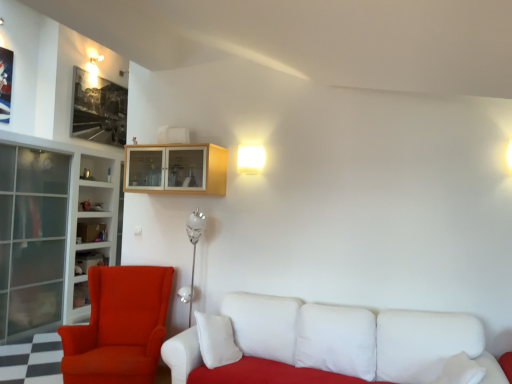
Question: Can you confirm if black matte picture frame at upper left is wider than matte glass shelf at left?

Choices:
 (A) yes
 (B) no

Answer: (B)

Question: Considering the relative sizes of black matte picture frame at upper left and matte glass shelf at left in the image provided, is black matte picture frame at upper left smaller than matte glass shelf at left?

Choices:
 (A) no
 (B) yes

Answer: (A)

Question: Is black matte picture frame at upper left facing towards matte glass shelf at left?

Choices:
 (A) no
 (B) yes

Answer: (A)

Question: Is black matte picture frame at upper left far away from matte glass shelf at left?

Choices:
 (A) no
 (B) yes

Answer: (B)

Question: Does black matte picture frame at upper left come in front of matte glass shelf at left?

Choices:
 (A) no
 (B) yes

Answer: (A)

Question: Is point (112, 213) closer or farther from the camera than point (78, 273)?

Choices:
 (A) closer
 (B) farther

Answer: (A)

Question: Considering the positions of white glass bookshelf at left and matte glass shelf at left in the image, is white glass bookshelf at left bigger or smaller than matte glass shelf at left?

Choices:
 (A) small
 (B) big

Answer: (B)

Question: From the image's perspective, is white glass bookshelf at left located above or below matte glass shelf at left?

Choices:
 (A) above
 (B) below

Answer: (A)

Question: From a real-world perspective, is white glass bookshelf at left above or below matte glass shelf at left?

Choices:
 (A) above
 (B) below

Answer: (A)

Question: Does point (424, 322) appear closer or farther from the camera than point (142, 362)?

Choices:
 (A) farther
 (B) closer

Answer: (B)

Question: From a real-world perspective, is white soft pillow at lower right physically located above or below velvet orange armchair at left?

Choices:
 (A) above
 (B) below

Answer: (A)

Question: From the image's perspective, is white soft pillow at lower right above or below velvet orange armchair at left?

Choices:
 (A) above
 (B) below

Answer: (A)

Question: Is white soft pillow at lower right to the left or to the right of velvet orange armchair at left in the image?

Choices:
 (A) left
 (B) right

Answer: (B)

Question: Is matte glass shelf at left situated inside white fabric couch at lower right or outside?

Choices:
 (A) outside
 (B) inside

Answer: (A)

Question: Is point (80, 258) closer or farther from the camera than point (214, 377)?

Choices:
 (A) closer
 (B) farther

Answer: (B)